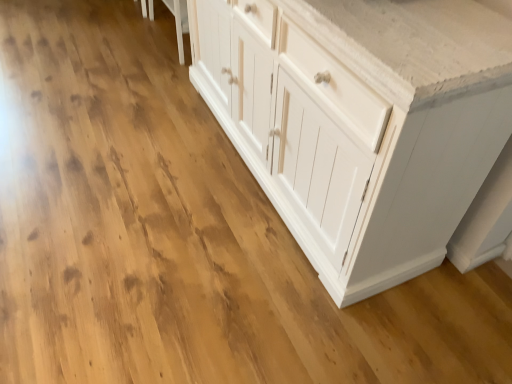
You are a GUI agent. You are given a task and a screenshot of the screen. Output one action in this format:
    pyautogui.click(x=<x>, y=<y>)
    Task: Click on the white wood cabinet at center
    This screenshot has height=384, width=512.
    Given the screenshot: What is the action you would take?
    pyautogui.click(x=360, y=121)

The image size is (512, 384). What do you see at coordinates (360, 121) in the screenshot?
I see `white wood cabinet at center` at bounding box center [360, 121].

Where is `white wood cabinet at center`? The width and height of the screenshot is (512, 384). white wood cabinet at center is located at coordinates (360, 121).